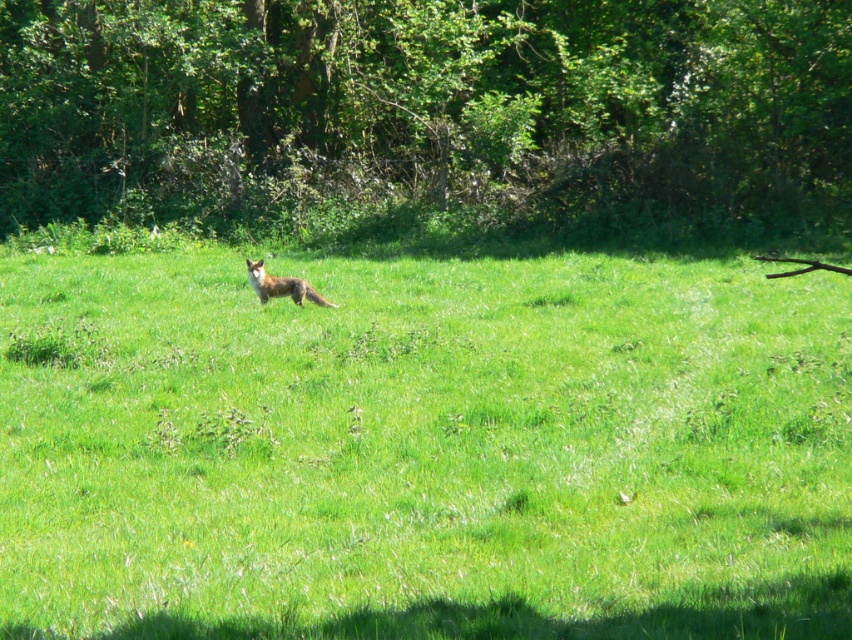
Based on the coordinates provided in the scene description, where is the green grassy field at center located?

The green grassy field at center is located at point coordinates of 0.702 in the x axis and 0.498 in the y axis.